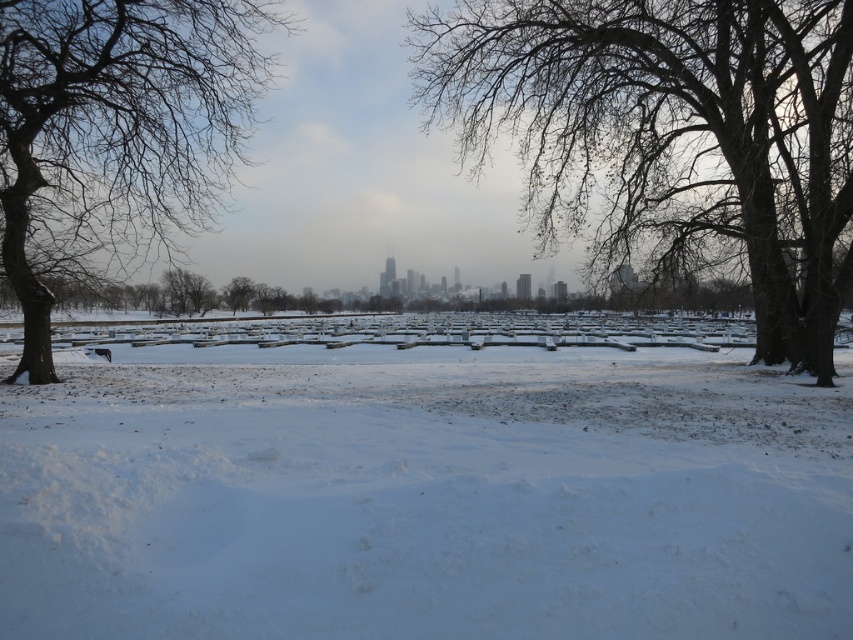
You are an observer standing in the winter scene described. You notice the white fluffy snow at center and the bare wood tree at center. Which object appears smaller in the image?

The white fluffy snow at center appears smaller compared to the bare wood tree at center.